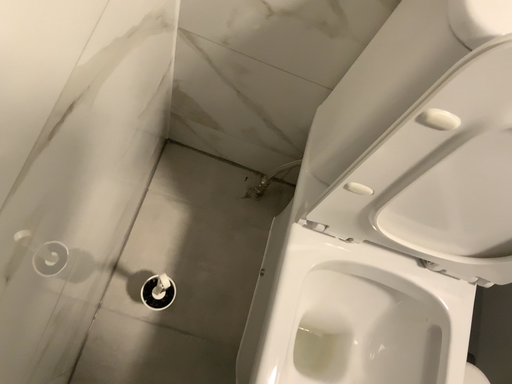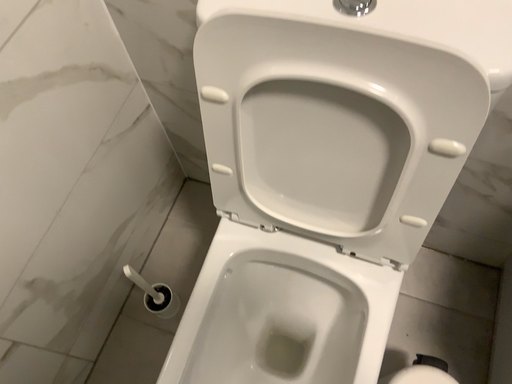
Question: How did the camera likely rotate when shooting the video?

Choices:
 (A) rotated downward
 (B) rotated upward

Answer: (B)